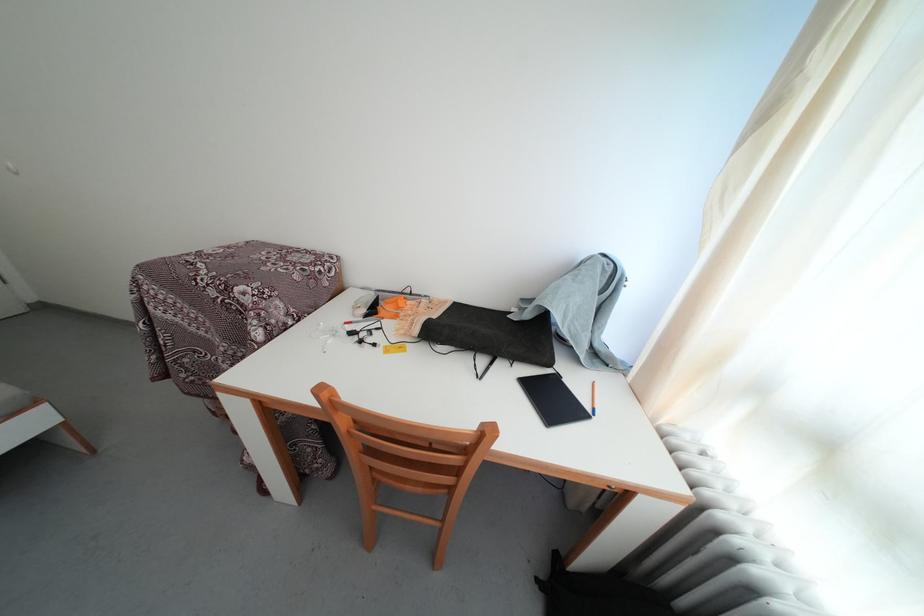
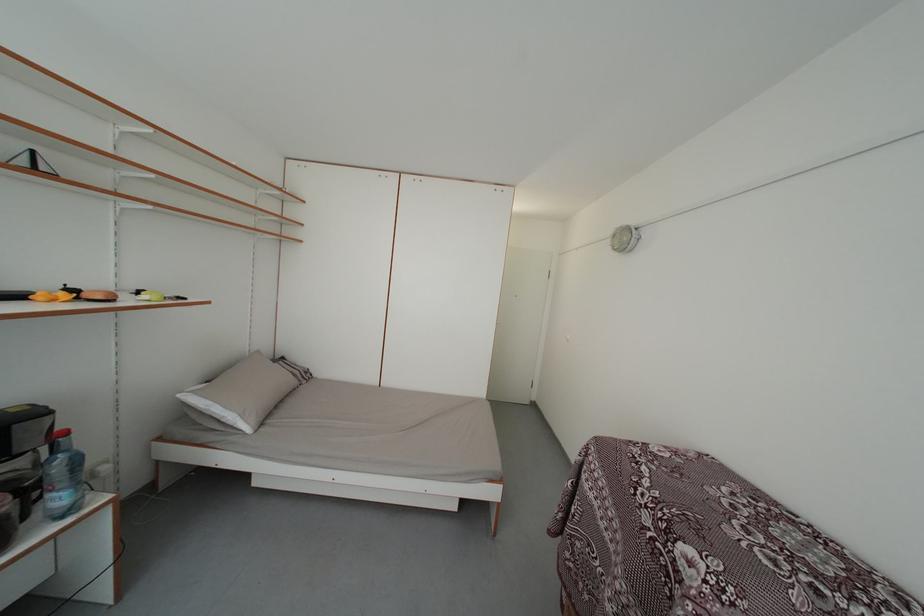
Question: The images are taken continuously from a first-person perspective. In which direction is your viewpoint rotating?

Choices:
 (A) Left
 (B) Right
 (C) Up
 (D) Down

Answer: (A)